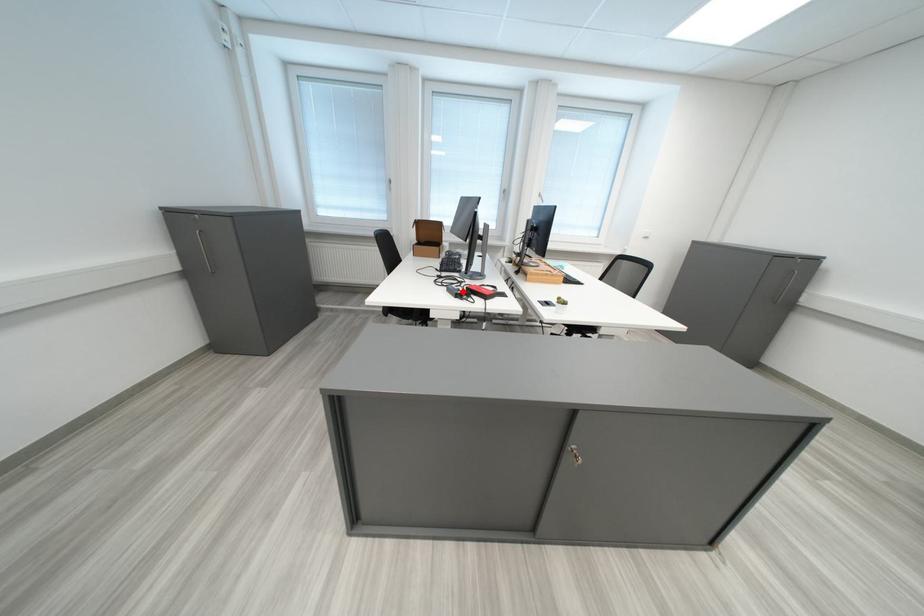
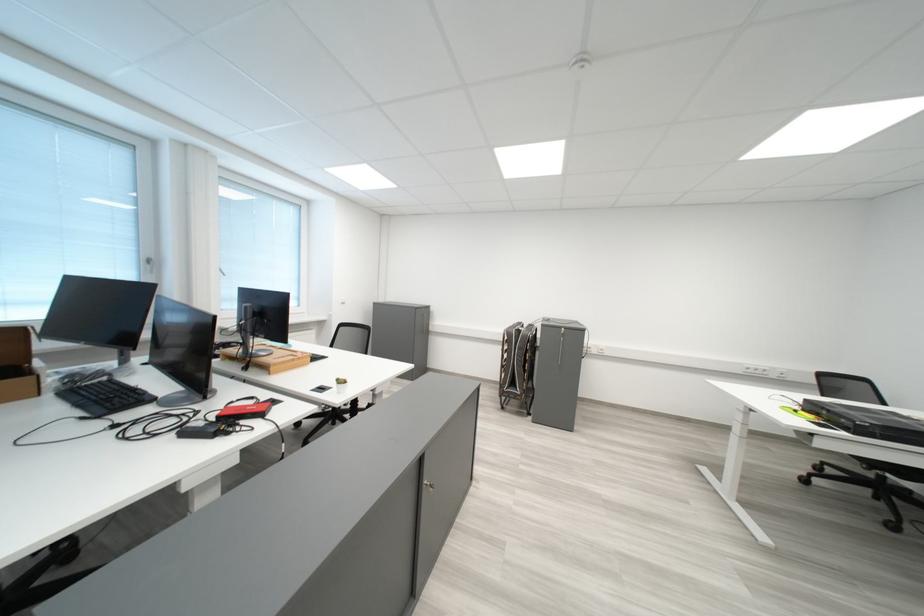
Find the pixel in the second image that matches the highlighted location in the first image.

(200, 436)